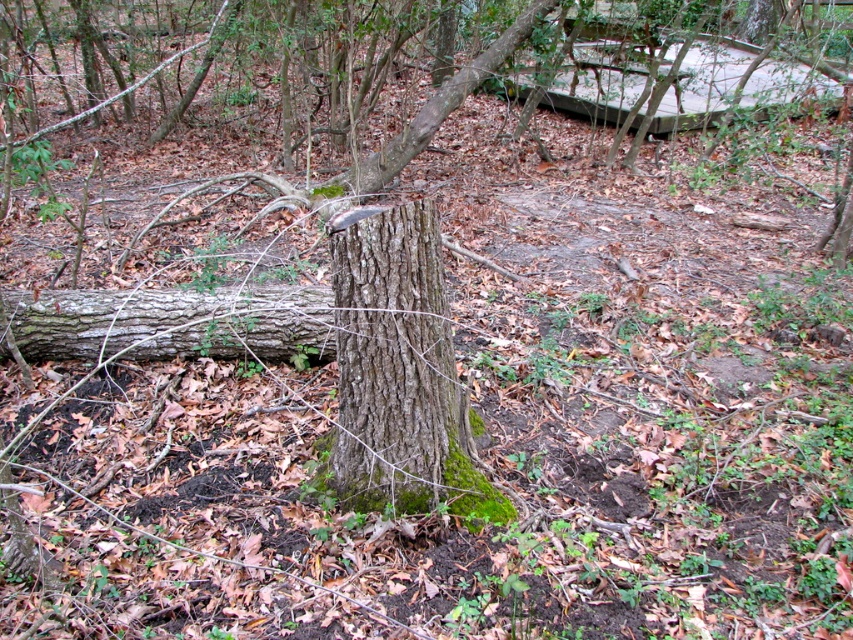
Question: Is green mossy bark at center wider than brown rough log at center?

Choices:
 (A) no
 (B) yes

Answer: (A)

Question: Is green mossy bark at center bigger than brown rough log at center?

Choices:
 (A) yes
 (B) no

Answer: (A)

Question: Considering the relative positions of green mossy bark at center and brown rough log at center in the image provided, where is green mossy bark at center located with respect to brown rough log at center?

Choices:
 (A) right
 (B) left

Answer: (A)